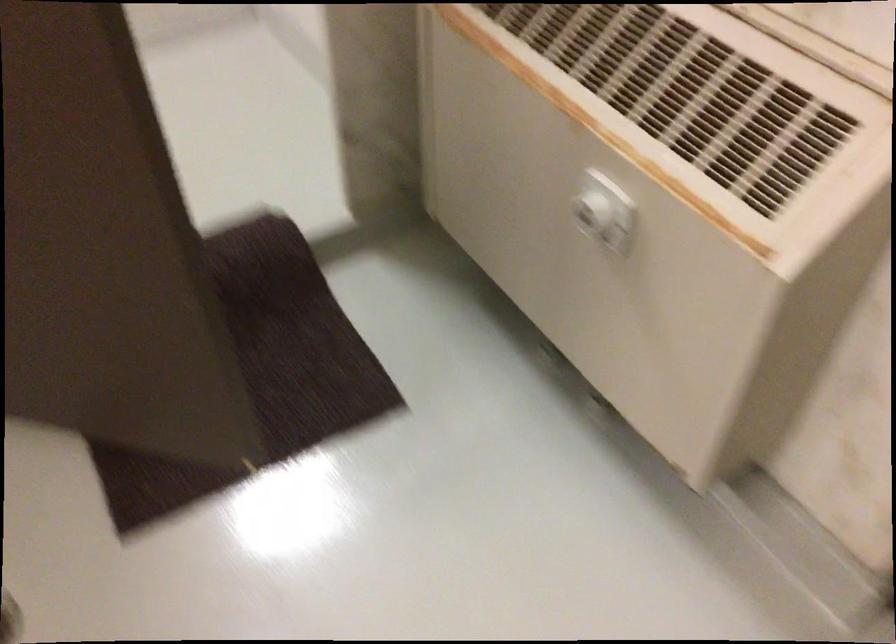
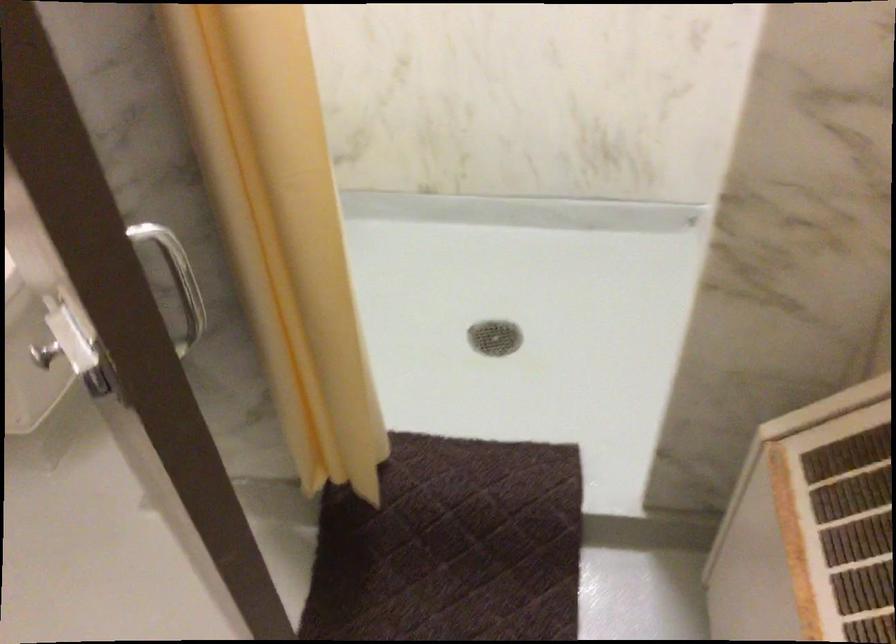
Question: The images are taken continuously from a first-person perspective. In which direction is your viewpoint rotating?

Choices:
 (A) Left
 (B) Right
 (C) Up
 (D) Down

Answer: (A)